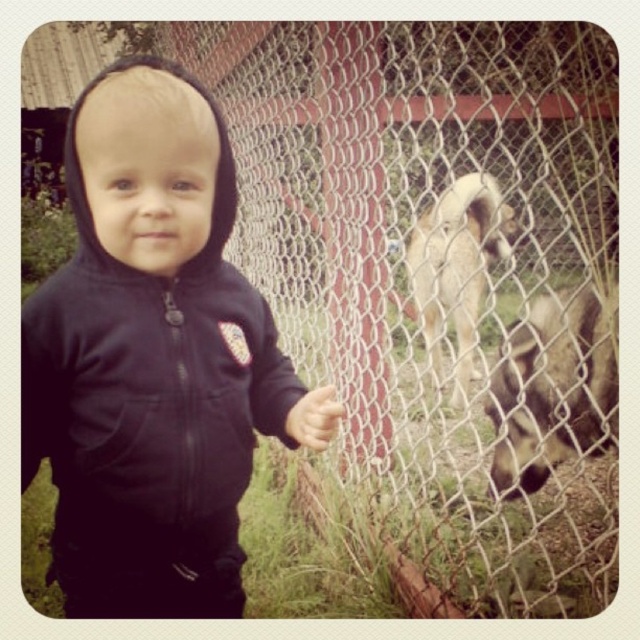
You are a photographer trying to capture a shot of the black fleece hoodie at center and the fuzzy brown fur at right. Based on their positions, which object is closer to the left edge of the photo?

The black fleece hoodie at center is positioned on the left side of fuzzy brown fur at right, so it is closer to the left edge of the photo.